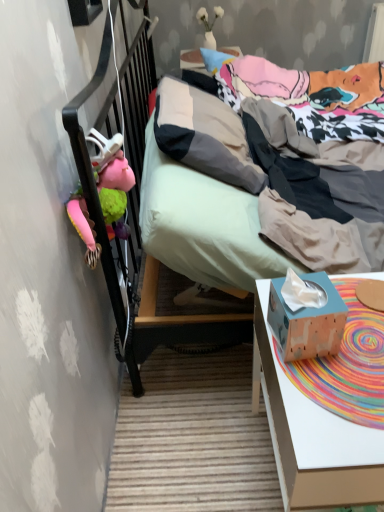
Where is `blank space above wooden tissue box at right (from a real-world perspective)`? blank space above wooden tissue box at right (from a real-world perspective) is located at coordinates (348, 355).